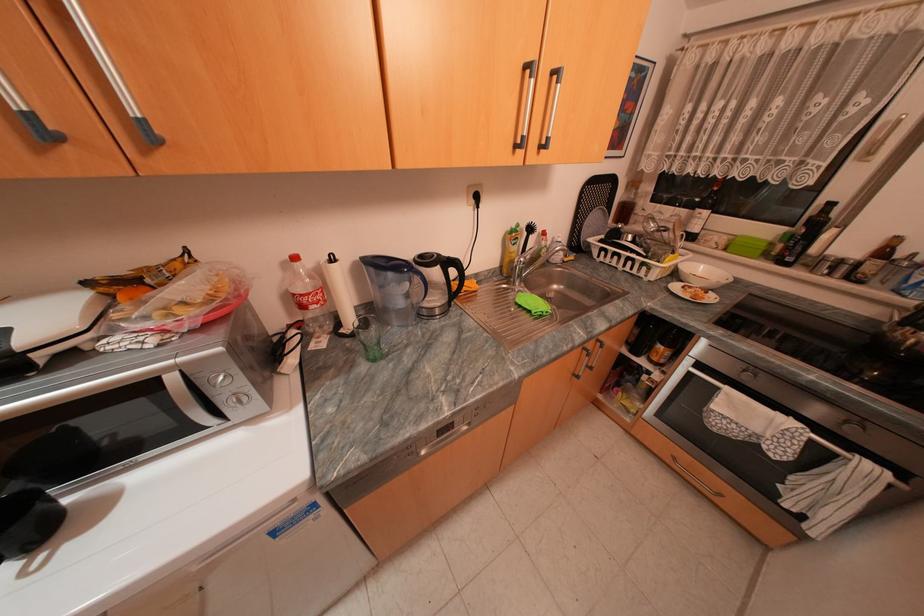
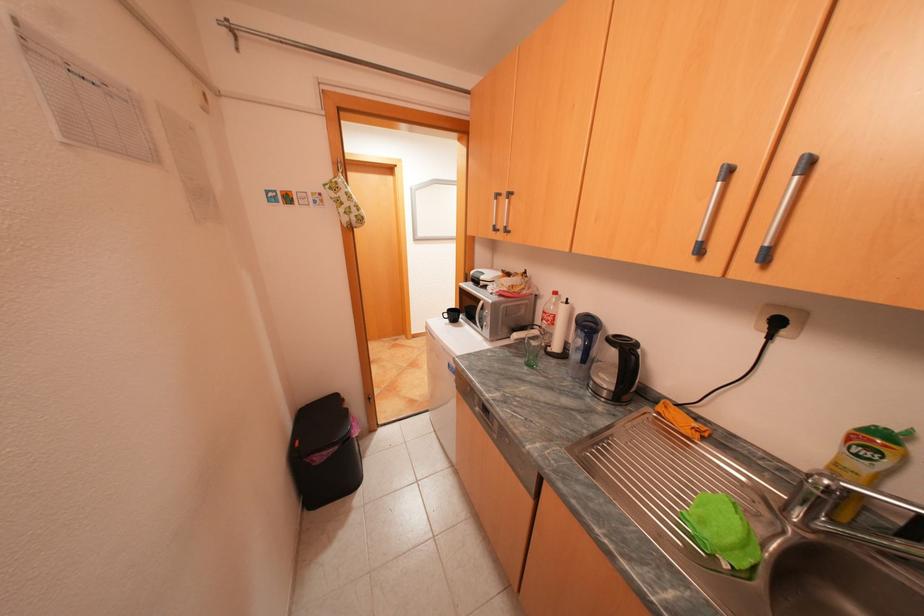
The point at (487, 197) is marked in the first image. Where is the corresponding point in the second image?

(786, 323)